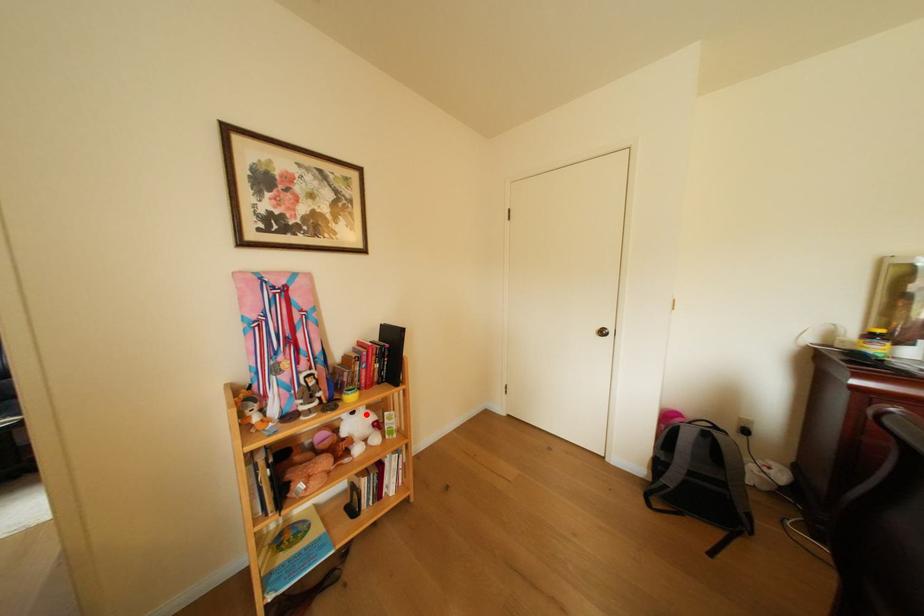
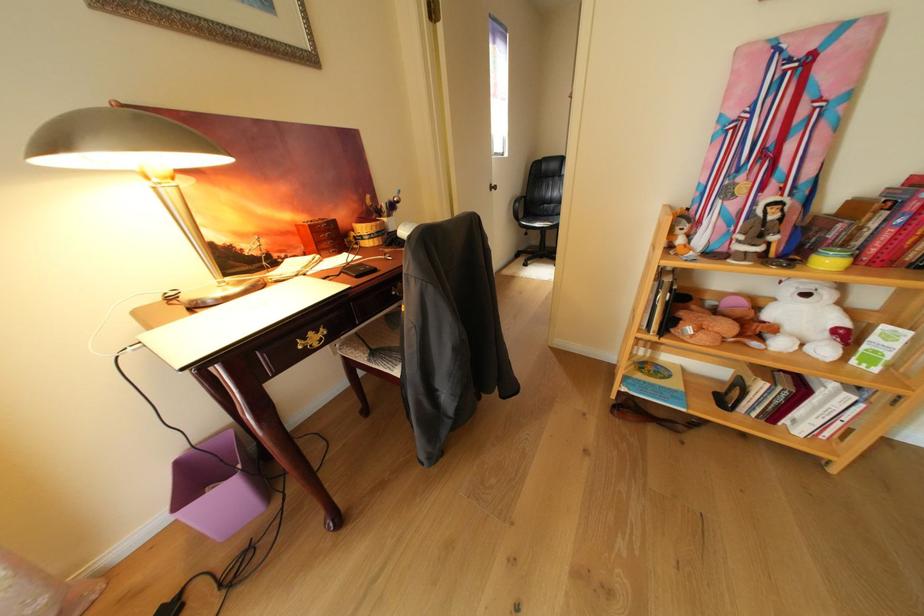
Find the pixel in the second image that matches the highlighted location in the first image.

(820, 297)